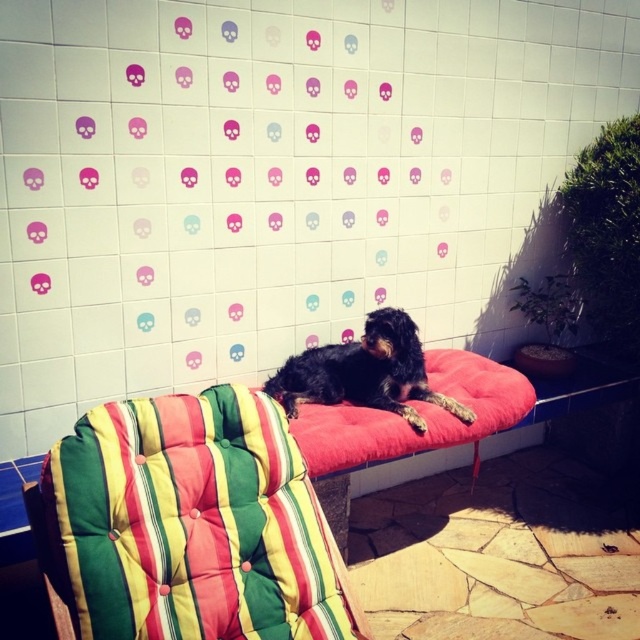
Question: Which of the following is the closest to the observer?

Choices:
 (A) (458, 404)
 (B) (108, 490)

Answer: (B)

Question: Does striped fabric cushion at center have a larger size compared to black fur dog at center?

Choices:
 (A) yes
 (B) no

Answer: (A)

Question: Is striped fabric cushion at center wider than black fur dog at center?

Choices:
 (A) no
 (B) yes

Answer: (B)

Question: Can you confirm if striped fabric cushion at center is wider than black fur dog at center?

Choices:
 (A) yes
 (B) no

Answer: (A)